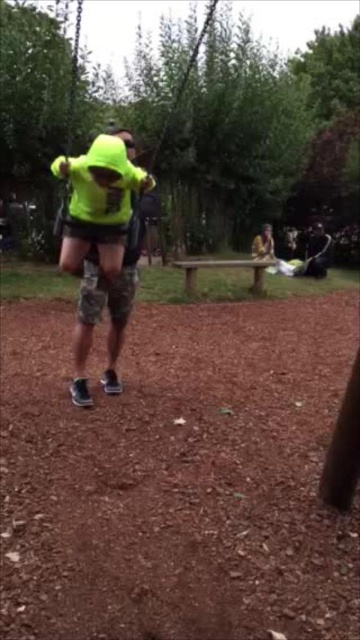
Question: Can you confirm if brown wooden bench at center is smaller than matte black backpack at center?

Choices:
 (A) no
 (B) yes

Answer: (A)

Question: Considering the relative positions of neon yellow hoodie at center and neon yellow fabric at center in the image provided, where is neon yellow hoodie at center located with respect to neon yellow fabric at center?

Choices:
 (A) left
 (B) right

Answer: (B)

Question: Among these objects, which one is farthest from the camera?

Choices:
 (A) brown wooden bench at center
 (B) neon yellow fabric at center
 (C) matte black backpack at center
 (D) brown mulch at center

Answer: (C)

Question: Among these objects, which one is nearest to the camera?

Choices:
 (A) brown wooden bench at center
 (B) matte black backpack at center

Answer: (A)

Question: Can you confirm if brown mulch at center is bigger than neon yellow fabric at center?

Choices:
 (A) yes
 (B) no

Answer: (B)

Question: Which of the following is the closest to the observer?

Choices:
 (A) (205, 268)
 (B) (309, 451)
 (C) (173, 97)
 (D) (106, 202)

Answer: (B)